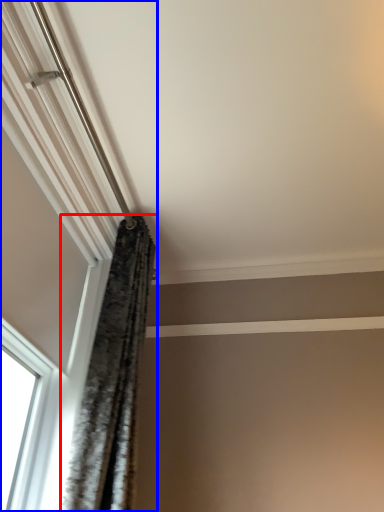
Question: Which object appears farthest to the camera in this image, curtain (highlighted by a red box) or window (highlighted by a blue box)?

Choices:
 (A) curtain
 (B) window

Answer: (A)